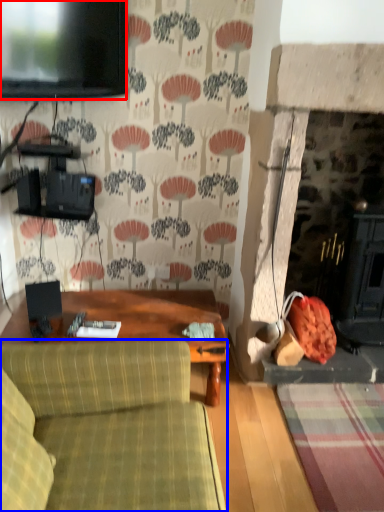
Question: Which point is closer to the camera, television (highlighted by a red box) or studio couch (highlighted by a blue box)?

Choices:
 (A) television
 (B) studio couch

Answer: (B)